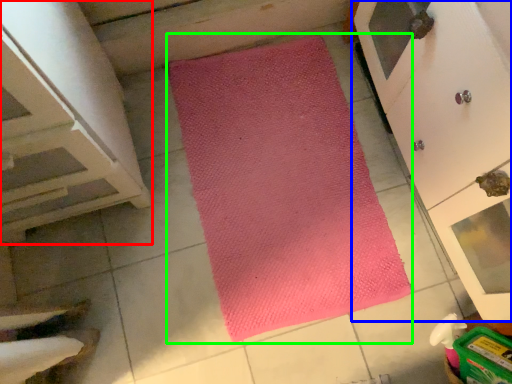
Question: Which is nearer to the cabinetry (highlighted by a red box)? cupboard (highlighted by a blue box) or mat (highlighted by a green box).

Choices:
 (A) cupboard
 (B) mat

Answer: (B)